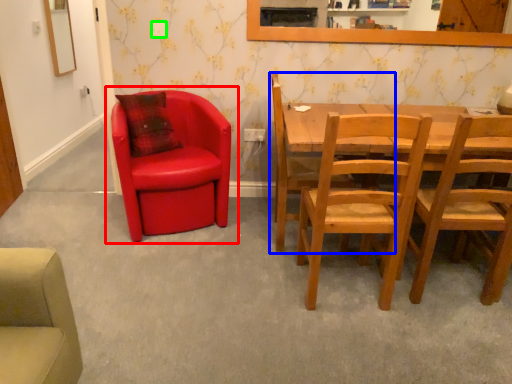
Question: Which object is positioned closest to chair (highlighted by a red box)? Select from chair (highlighted by a blue box) and power outlet (highlighted by a green box).

Choices:
 (A) chair
 (B) power outlet

Answer: (A)